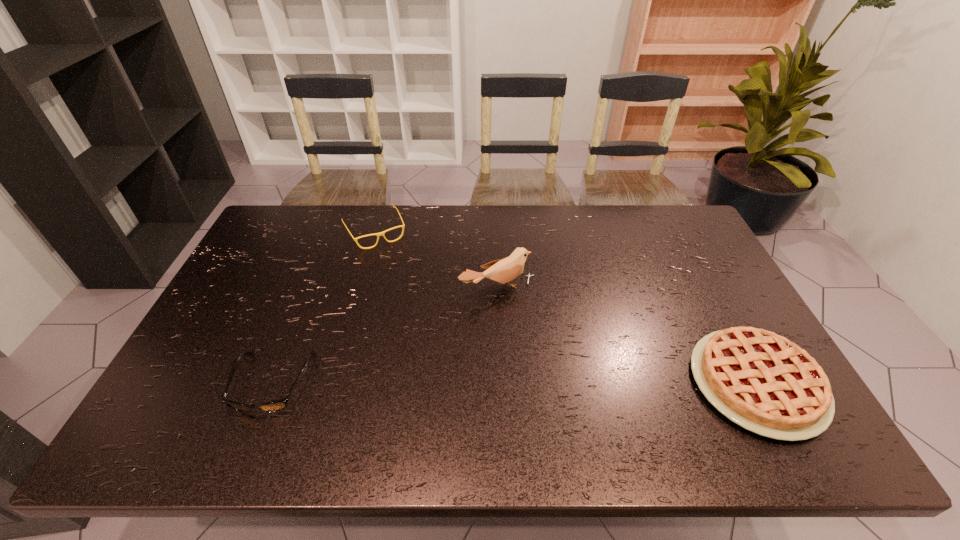
Locate an element on the screen. Image resolution: width=960 pixels, height=540 pixels. free space located 0.370m in front of the lenses of the farther spectacles is located at coordinates (424, 325).

The height and width of the screenshot is (540, 960). I want to click on vacant space located 0.400m in front of the lenses of the farther spectacles, so click(x=428, y=332).

Identify the location of object that is at the far edge. (381, 233).

The image size is (960, 540). Identify the location of spectacles located at the near edge. (274, 406).

This screenshot has height=540, width=960. Find the location of `pie positioned at the near edge`. pie positioned at the near edge is located at coordinates (763, 382).

Where is `object present at the left edge`? object present at the left edge is located at coordinates (274, 406).

Find the location of `object located in the right edge section of the desktop`. object located in the right edge section of the desktop is located at coordinates (763, 382).

The image size is (960, 540). In order to click on object located at the near left corner in this screenshot , I will do `click(274, 406)`.

This screenshot has width=960, height=540. I want to click on object present at the near right corner, so click(763, 382).

At what (x,y) coordinates should I click in order to perform the action: click on vacant space at the far edge of the desktop. Please return your answer as a coordinate pair (x, y). The width and height of the screenshot is (960, 540). Looking at the image, I should click on (341, 207).